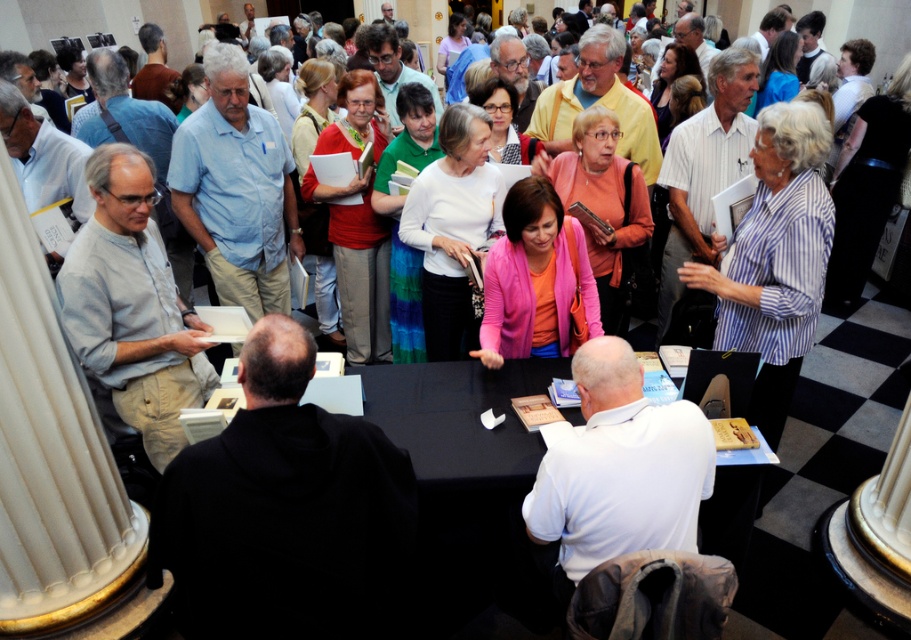
This screenshot has height=640, width=911. What do you see at coordinates (285, 513) in the screenshot?
I see `black hoodie at center` at bounding box center [285, 513].

Can you confirm if black hoodie at center is smaller than black fabric table at center?

Yes, black hoodie at center is smaller than black fabric table at center.

Is point (341, 419) positioned before point (523, 378)?

Yes, it is in front of point (523, 378).

Identify the location of black hoodie at center. (285, 513).

Can you confirm if gray cotton shirt at left is positioned to the right of striped cotton shirt at center?

In fact, gray cotton shirt at left is to the left of striped cotton shirt at center.

Between gray cotton shirt at left and striped cotton shirt at center, which one appears on the left side from the viewer's perspective?

gray cotton shirt at left is more to the left.

Measure the distance between gray cotton shirt at left and camera.

2.07 meters

Find the location of a particular element. The width and height of the screenshot is (911, 640). gray cotton shirt at left is located at coordinates (132, 305).

Between striped cotton shirt at center and white matte sweater at center, which one appears on the left side from the viewer's perspective?

From the viewer's perspective, white matte sweater at center appears more on the left side.

Is point (789, 403) positioned behind point (425, 208)?

No, (789, 403) is closer to viewer.

Who is more forward, (809,145) or (462,177)?

Positioned in front is point (809,145).

What are the coordinates of `striped cotton shirt at center` in the screenshot? It's located at (775, 259).